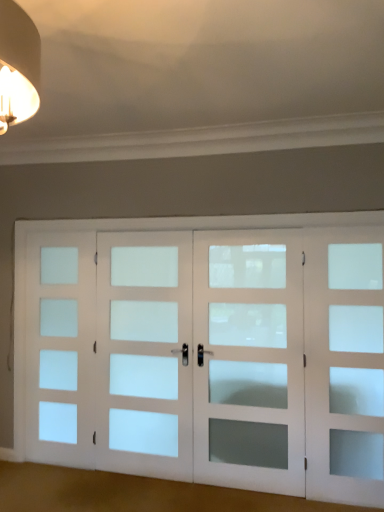
Question: Is white frosted glass door at right, which is counted as the fourth screen door, starting from the left, to the left of white frosted glass door at center, the third screen door in the left-to-right sequence, from the viewer's perspective?

Choices:
 (A) no
 (B) yes

Answer: (A)

Question: Considering the relative positions of white frosted glass door at right, which is counted as the fourth screen door, starting from the left, and white frosted glass door at center, acting as the second screen door starting from the right, in the image provided, is white frosted glass door at right, which is counted as the fourth screen door, starting from the left, to the right of white frosted glass door at center, acting as the second screen door starting from the right, from the viewer's perspective?

Choices:
 (A) no
 (B) yes

Answer: (B)

Question: Can you confirm if white frosted glass door at right, which is counted as the fourth screen door, starting from the left, is wider than white frosted glass door at center, acting as the second screen door starting from the right?

Choices:
 (A) no
 (B) yes

Answer: (A)

Question: From the image's perspective, is white frosted glass door at right, which is counted as the fourth screen door, starting from the left, below white frosted glass door at center, the third screen door in the left-to-right sequence?

Choices:
 (A) no
 (B) yes

Answer: (B)

Question: Considering the relative sizes of white frosted glass door at right, which is counted as the fourth screen door, starting from the left, and white frosted glass door at center, the third screen door in the left-to-right sequence, in the image provided, is white frosted glass door at right, which is counted as the fourth screen door, starting from the left, smaller than white frosted glass door at center, the third screen door in the left-to-right sequence,?

Choices:
 (A) yes
 (B) no

Answer: (A)

Question: Considering the positions of point (69, 432) and point (332, 254), is point (69, 432) closer or farther from the camera than point (332, 254)?

Choices:
 (A) closer
 (B) farther

Answer: (B)

Question: Is white frosted glass door at left, which is the fourth screen door from right to left, taller or shorter than white frosted glass door at right, which is the first screen door in right-to-left order?

Choices:
 (A) short
 (B) tall

Answer: (A)

Question: Is white frosted glass door at left, which is the fourth screen door from right to left, situated inside white frosted glass door at right, which is the first screen door in right-to-left order, or outside?

Choices:
 (A) inside
 (B) outside

Answer: (B)

Question: Visually, is white frosted glass door at left, which appears as the 1th screen door when viewed from the left, positioned to the left or to the right of white frosted glass door at right, which is counted as the fourth screen door, starting from the left?

Choices:
 (A) right
 (B) left

Answer: (B)

Question: Considering the positions of white frosted glass door at right, which is the first screen door in right-to-left order, and white frosted glass door at left, which appears as the 1th screen door when viewed from the left, in the image, is white frosted glass door at right, which is the first screen door in right-to-left order, wider or thinner than white frosted glass door at left, which appears as the 1th screen door when viewed from the left,?

Choices:
 (A) thin
 (B) wide

Answer: (B)

Question: From their relative heights in the image, would you say white frosted glass door at right, which is the first screen door in right-to-left order, is taller or shorter than white frosted glass door at left, which appears as the 1th screen door when viewed from the left?

Choices:
 (A) tall
 (B) short

Answer: (A)

Question: Choose the correct answer: Is white frosted glass door at right, which is the first screen door in right-to-left order, inside white frosted glass door at left, which is the fourth screen door from right to left, or outside it?

Choices:
 (A) outside
 (B) inside

Answer: (A)

Question: From a real-world perspective, relative to white frosted glass door at left, which is the fourth screen door from right to left, is white frosted glass door at right, which is the first screen door in right-to-left order, vertically above or below?

Choices:
 (A) above
 (B) below

Answer: (B)

Question: Is white frosted glass door at right, which is the first screen door in right-to-left order, to the left or to the right of satin white glass door at center, the second screen door viewed from the left, in the image?

Choices:
 (A) left
 (B) right

Answer: (B)

Question: Is white frosted glass door at right, which is counted as the fourth screen door, starting from the left, bigger or smaller than satin white glass door at center, which is counted as the third screen door, starting from the right?

Choices:
 (A) small
 (B) big

Answer: (A)